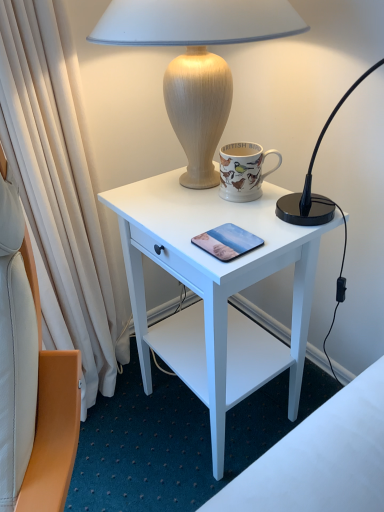
Question: From the image's perspective, is wooden lamp at upper center located above or below white matte desk at center?

Choices:
 (A) above
 (B) below

Answer: (A)

Question: Considering the positions of wooden lamp at upper center and white matte desk at center in the image, is wooden lamp at upper center taller or shorter than white matte desk at center?

Choices:
 (A) tall
 (B) short

Answer: (B)

Question: Which of these objects is positioned farthest from the matte glass pad at center?

Choices:
 (A) wooden lamp at upper center
 (B) porcelain mug with colorful birds at upper center
 (C) white matte desk at center

Answer: (A)

Question: Based on their relative distances, which object is farther from the wooden lamp at upper center?

Choices:
 (A) white matte desk at center
 (B) porcelain mug with colorful birds at upper center
 (C) matte glass pad at center

Answer: (C)